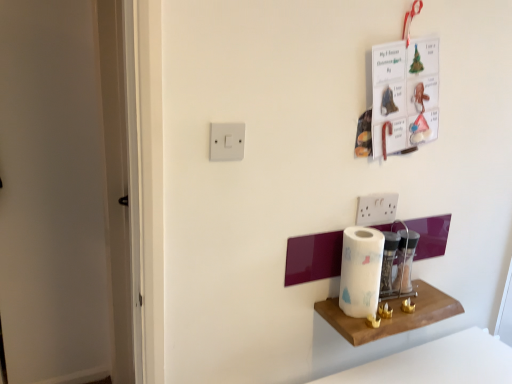
You are a GUI agent. You are given a task and a screenshot of the screen. Output one action in this format:
    pyautogui.click(x=<x>, y=<y>)
    Task: Click on the wooden shelf at lower right
    The image size is (512, 384).
    Given the screenshot: What is the action you would take?
    pyautogui.click(x=392, y=315)

The image size is (512, 384). What do you see at coordinates (392, 315) in the screenshot?
I see `wooden shelf at lower right` at bounding box center [392, 315].

I want to click on wooden shelf at lower right, so pos(392,315).

Considering the sizes of objects wooden shelf at lower right and white plastic light switch at upper center in the image provided, who is thinner, wooden shelf at lower right or white plastic light switch at upper center?

white plastic light switch at upper center.

Does wooden shelf at lower right turn towards white plastic light switch at upper center?

No, wooden shelf at lower right is not aimed at white plastic light switch at upper center.

Is wooden shelf at lower right not inside white plastic light switch at upper center?

Absolutely, wooden shelf at lower right is external to white plastic light switch at upper center.

Identify the location of paper towel below the white plastic light switch at upper center (from the image's perspective). (361, 271).

From the image's perspective, which is above, white paper at center or white plastic light switch at upper center?

From the image's view, white plastic light switch at upper center is above.

How many degrees apart are the facing directions of white paper at center and white plastic light switch at upper center?

The angle between the facing direction of white paper at center and the facing direction of white plastic light switch at upper center is 0.00944 degrees.

Considering the positions of objects white plastic light switch at upper center and white paper at center in the image provided, who is more to the right, white plastic light switch at upper center or white paper at center?

white paper at center is more to the right.

Which object is wider, white plastic light switch at upper center or white paper at center?

white paper at center is wider.

From the picture: Could you tell me if white plastic light switch at upper center is facing white paper at center?

No, white plastic light switch at upper center is not facing towards white paper at center.

Would you say white plastic light switch at upper center is inside or outside white paper at center?

The correct answer is: outside.

Between white paper at center and wooden shelf at lower right, which one has smaller size?

wooden shelf at lower right is smaller.

Considering the relative positions of white paper at center and wooden shelf at lower right in the image provided, is white paper at center to the left of wooden shelf at lower right from the viewer's perspective?

Yes, white paper at center is to the left of wooden shelf at lower right.

Does point (345, 295) come behind point (419, 308)?

No, it is in front of (419, 308).

From the image's perspective, is white paper at center on top of wooden shelf at lower right?

Yes, from the image's perspective, white paper at center is on top of wooden shelf at lower right.

Considering the sizes of wooden shelf at lower right and white paper at center in the image, is wooden shelf at lower right wider or thinner than white paper at center?

Considering their sizes, wooden shelf at lower right looks broader than white paper at center.

Is white paper at center a part of wooden shelf at lower right?

No.

Are wooden shelf at lower right and white paper at center far apart?

No.

From the image's perspective, between wooden shelf at lower right and white paper at center, who is located below?

wooden shelf at lower right, from the image's perspective.

Is point (238, 154) positioned behind point (395, 313)?

No.

Between white plastic light switch at upper center and wooden shelf at lower right, which one has smaller size?

With smaller size is white plastic light switch at upper center.

The width and height of the screenshot is (512, 384). I want to click on shelf below the white plastic light switch at upper center (from the image's perspective), so [x=392, y=315].

In the image, is white plastic light switch at upper center on the left side or the right side of wooden shelf at lower right?

Clearly, white plastic light switch at upper center is on the left of wooden shelf at lower right in the image.

This screenshot has height=384, width=512. In order to click on light switch in front of the wooden shelf at lower right in this screenshot , I will do `click(227, 141)`.

At what (x,y) coordinates should I click in order to perform the action: click on paper towel on the right side of white plastic light switch at upper center. Please return your answer as a coordinate pair (x, y). Looking at the image, I should click on (361, 271).

Based on their spatial positions, is wooden shelf at lower right or white plastic light switch at upper center closer to white paper at center?

Among the two, wooden shelf at lower right is located nearer to white paper at center.

Based on their spatial positions, is white plastic light switch at upper center or wooden shelf at lower right further from white paper at center?

white plastic light switch at upper center.

Considering their positions, is white paper at center positioned closer to white plastic light switch at upper center than wooden shelf at lower right?

white paper at center lies closer to white plastic light switch at upper center than the other object.

From the image, which object appears to be farther from wooden shelf at lower right, white paper at center or white plastic light switch at upper center?

A: white plastic light switch at upper center is further to wooden shelf at lower right.

Which object lies nearer to the anchor point wooden shelf at lower right, white plastic light switch at upper center or white paper at center?

white paper at center lies closer to wooden shelf at lower right than the other object.

When comparing their distances from white plastic light switch at upper center, does wooden shelf at lower right or white paper at center seem further?

wooden shelf at lower right lies further to white plastic light switch at upper center than the other object.

I want to click on paper towel between white plastic light switch at upper center and wooden shelf at lower right in the horizontal direction, so [361, 271].